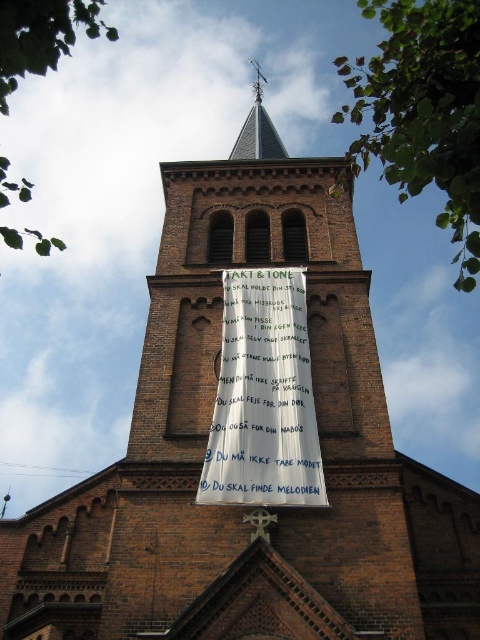
Question: Is white paper banner at center to the right of smooth gray spire at upper center from the viewer's perspective?

Choices:
 (A) yes
 (B) no

Answer: (A)

Question: Does white paper banner at center have a greater width compared to smooth gray spire at upper center?

Choices:
 (A) no
 (B) yes

Answer: (A)

Question: Can you confirm if white paper banner at center is smaller than smooth gray spire at upper center?

Choices:
 (A) yes
 (B) no

Answer: (A)